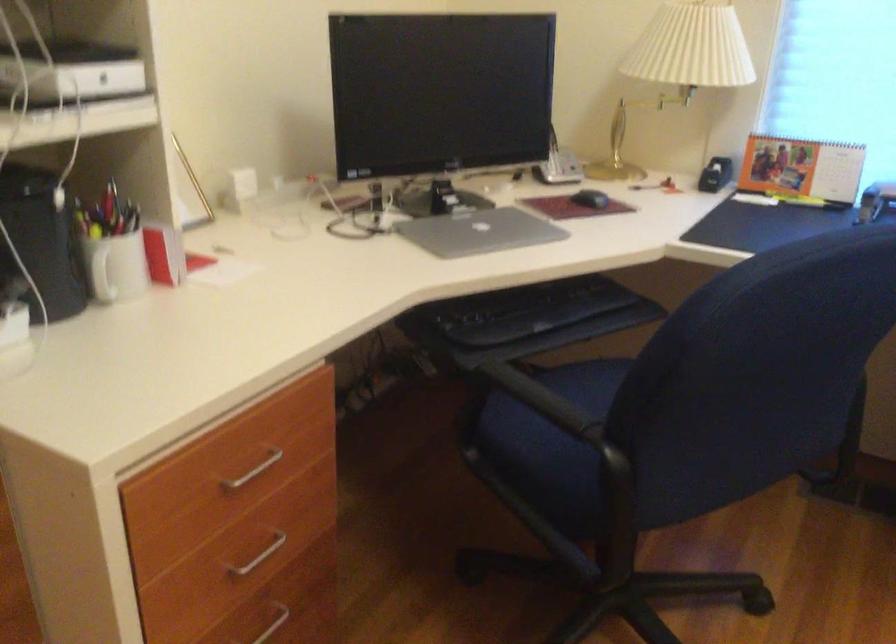
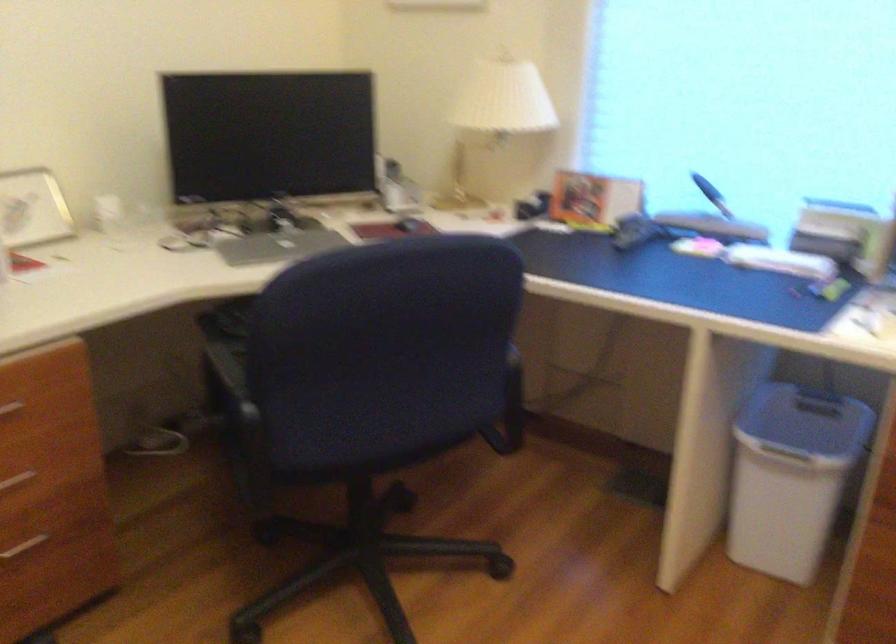
What movement of the cameraman would produce the second image?

The cameraman moved toward right, backward.